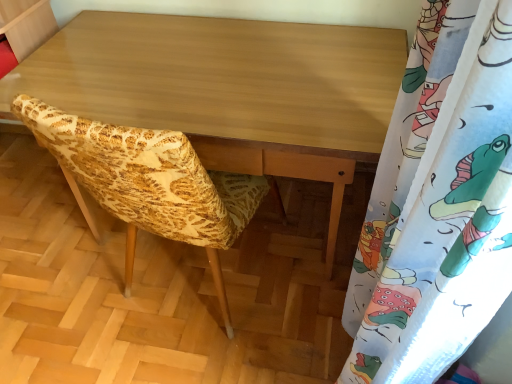
Question: Is light brown wood desk at center bigger than yellow fabric chair at center?

Choices:
 (A) no
 (B) yes

Answer: (B)

Question: Considering the relative sizes of light brown wood desk at center and yellow fabric chair at center in the image provided, is light brown wood desk at center shorter than yellow fabric chair at center?

Choices:
 (A) no
 (B) yes

Answer: (A)

Question: From the image's perspective, would you say light brown wood desk at center is positioned over yellow fabric chair at center?

Choices:
 (A) yes
 (B) no

Answer: (A)

Question: From a real-world perspective, is light brown wood desk at center beneath yellow fabric chair at center?

Choices:
 (A) no
 (B) yes

Answer: (A)

Question: Is light brown wood desk at center smaller than yellow fabric chair at center?

Choices:
 (A) yes
 (B) no

Answer: (B)

Question: From a real-world perspective, relative to light brown wood desk at center, is white fabric with colorful cartoon print at right vertically above or below?

Choices:
 (A) below
 (B) above

Answer: (B)

Question: Is white fabric with colorful cartoon print at right taller or shorter than light brown wood desk at center?

Choices:
 (A) short
 (B) tall

Answer: (B)

Question: Does point (464, 183) appear closer or farther from the camera than point (294, 31)?

Choices:
 (A) farther
 (B) closer

Answer: (B)

Question: Is white fabric with colorful cartoon print at right wider or thinner than light brown wood desk at center?

Choices:
 (A) wide
 (B) thin

Answer: (B)

Question: From a real-world perspective, is yellow fabric chair at center physically located above or below white fabric with colorful cartoon print at right?

Choices:
 (A) above
 (B) below

Answer: (B)

Question: From the image's perspective, relative to white fabric with colorful cartoon print at right, is yellow fabric chair at center above or below?

Choices:
 (A) below
 (B) above

Answer: (B)

Question: Considering the positions of yellow fabric chair at center and white fabric with colorful cartoon print at right in the image, is yellow fabric chair at center bigger or smaller than white fabric with colorful cartoon print at right?

Choices:
 (A) big
 (B) small

Answer: (A)

Question: Is yellow fabric chair at center inside or outside of white fabric with colorful cartoon print at right?

Choices:
 (A) inside
 (B) outside

Answer: (B)

Question: Considering the positions of point (326, 109) and point (138, 206), is point (326, 109) closer or farther from the camera than point (138, 206)?

Choices:
 (A) closer
 (B) farther

Answer: (B)

Question: Is light brown wood desk at center bigger or smaller than yellow fabric chair at center?

Choices:
 (A) big
 (B) small

Answer: (A)